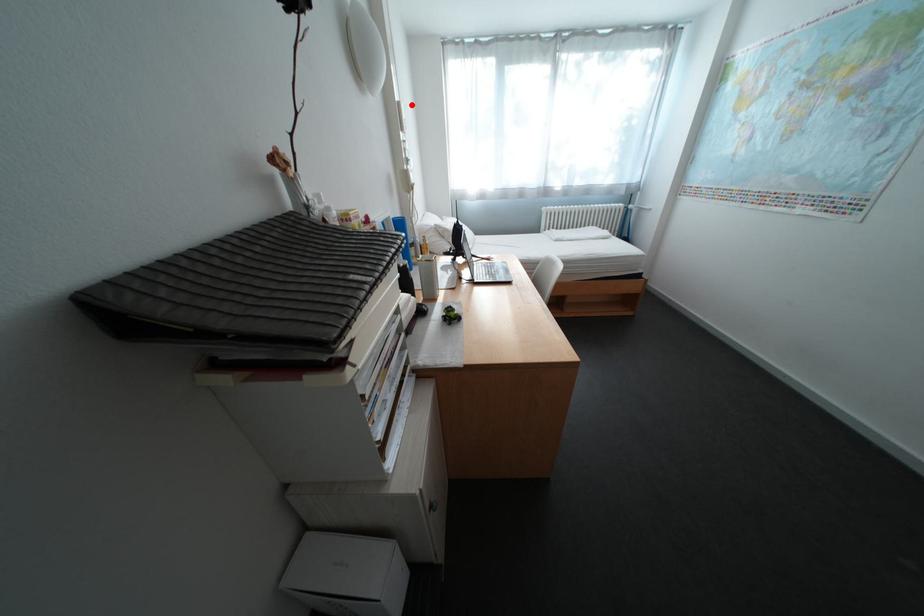
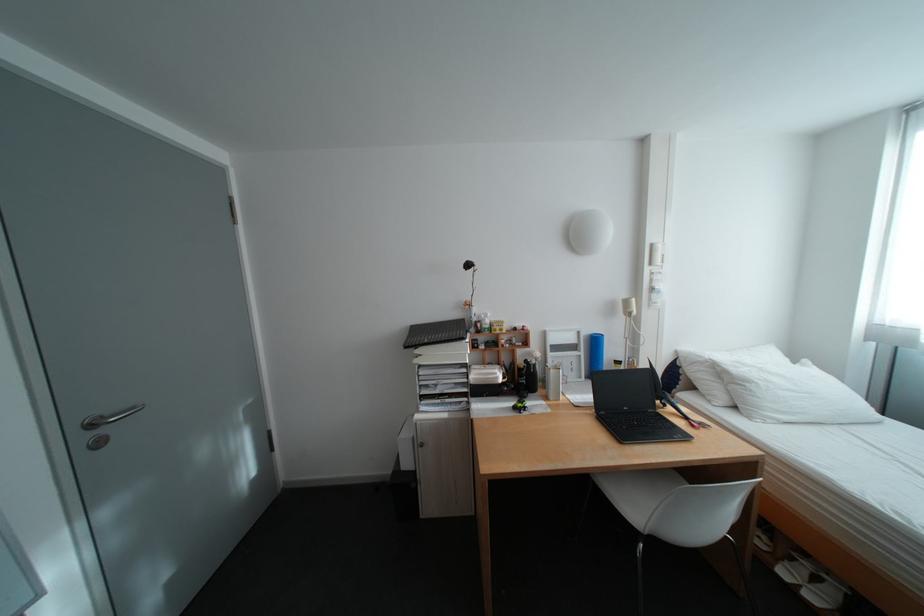
Where in the second image is the point corresponding to the highlighted location from the first image?

(664, 246)